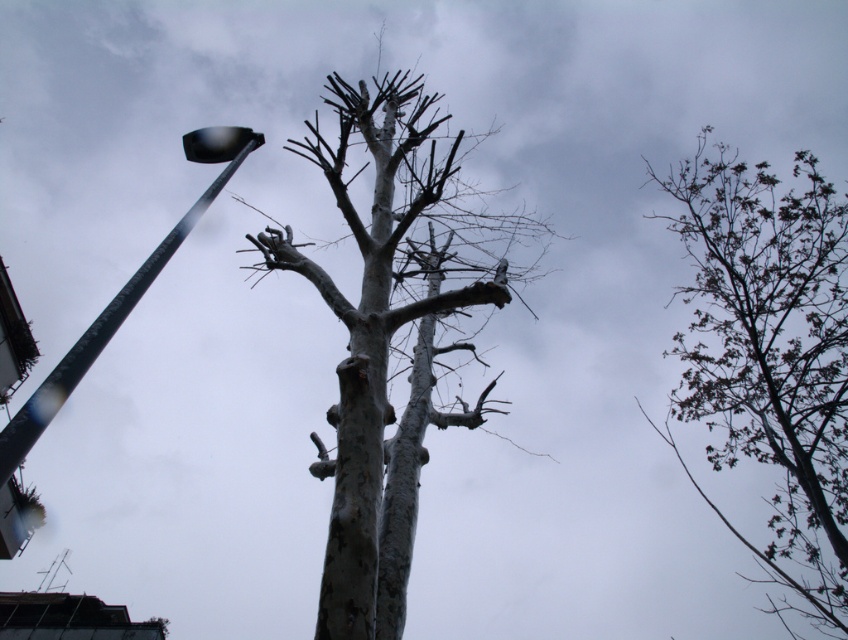
You are a city planner assessing the safety of the current tree and street light placement. Given that the minimum required distance between trees and street lights for maintenance access is 5 meters, is the current spacing between the smooth bark tree at center and the metallic gray street light at left compliant with safety regulations?

The distance between the smooth bark tree at center and the metallic gray street light at left is 6.33 meters, which exceeds the minimum required 5 meters for maintenance access. Therefore, the current spacing complies with safety regulations.